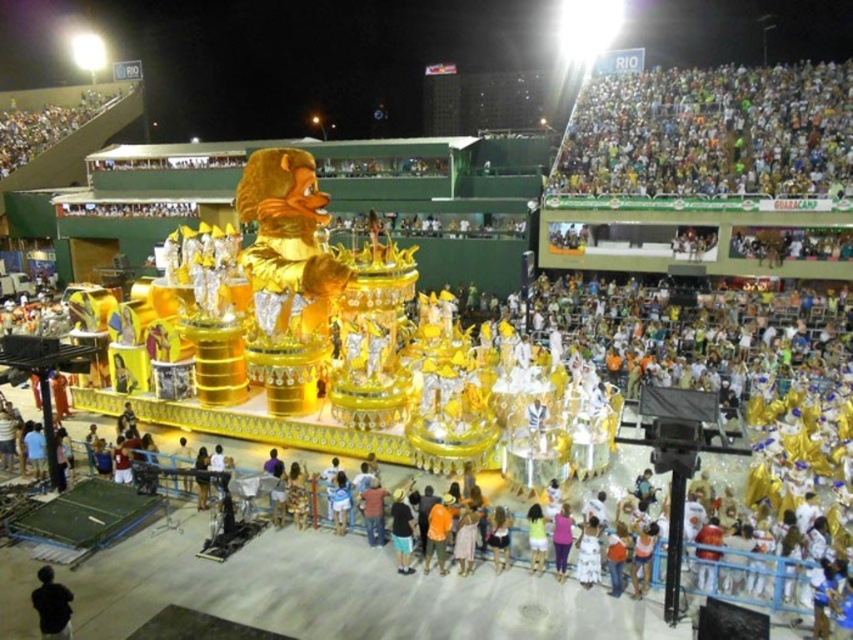
You are a photographer at the carnival parade. You want to capture a photo that includes both the white cloth crowd at upper right and the black matte jacket at lower left. Which object should you focus on first to ensure both are in the frame?

You should focus on the white cloth crowd at upper right first because it is larger in size than the black matte jacket at lower left, so it will take up more space in the frame and ensure both are included.

You are a photographer at the carnival parade. You want to capture a photo that includes both the white cloth crowd at upper right and the black matte jacket at lower left. Which object should you focus on first to ensure both are in frame?

You should focus on the white cloth crowd at upper right first since it might be wider than the black matte jacket at lower left, ensuring there is enough space in the frame for both.

You are a photographer standing at the center of the carnival parade. You want to capture a photo that includes both the white cloth crowd at upper right and the black matte jacket at lower left. Given that your camera has a maximum zoom range of 75 meters, will you be able to fit both subjects in the frame without moving your position?

The white cloth crowd at upper right and the black matte jacket at lower left are 74.98 meters apart. Since the distance between them is just under the camera maximum zoom range of 75 meters, you can fit both subjects in the frame without moving your position.